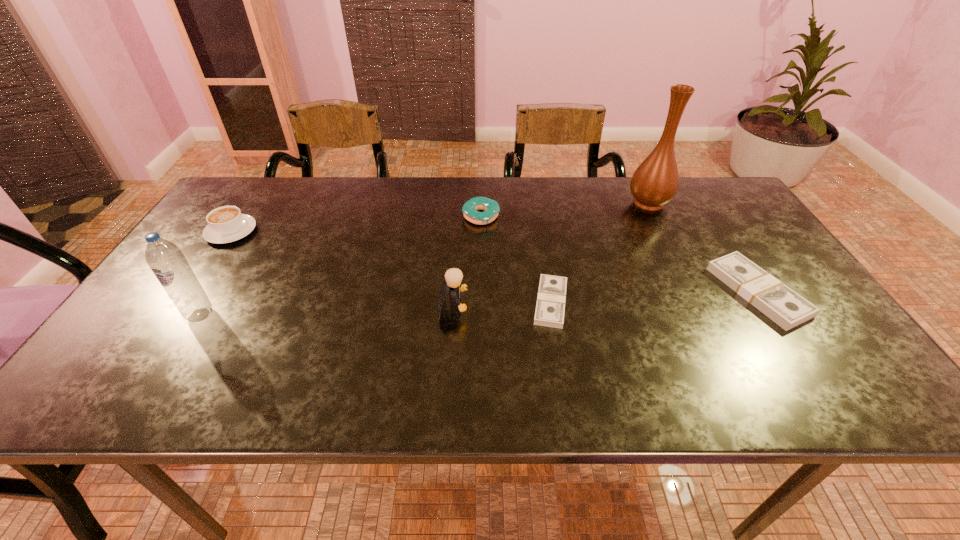
Find the location of a particular element. The width and height of the screenshot is (960, 540). vase located in the far edge section of the desktop is located at coordinates (655, 182).

The height and width of the screenshot is (540, 960). I want to click on cappuccino that is at the left edge, so click(226, 224).

This screenshot has width=960, height=540. I want to click on water bottle present at the left edge, so click(167, 262).

You are a GUI agent. You are given a task and a screenshot of the screen. Output one action in this format:
    pyautogui.click(x=<x>, y=<y>)
    Task: Click on the object that is positioned at the right edge
    This screenshot has height=540, width=960.
    Given the screenshot: What is the action you would take?
    pyautogui.click(x=781, y=304)

Where is `object at the far left corner`? object at the far left corner is located at coordinates (226, 224).

I want to click on vacant space at the far edge, so click(509, 192).

Where is `blank area at the near edge`? The height and width of the screenshot is (540, 960). blank area at the near edge is located at coordinates (568, 359).

In the image, there is a desktop. Where is `free space at the left edge`? This screenshot has height=540, width=960. free space at the left edge is located at coordinates (155, 289).

Find the location of `vacant space at the right edge`. vacant space at the right edge is located at coordinates (776, 266).

At what (x,y) coordinates should I click in order to perform the action: click on vacant point at the far left corner. Please return your answer as a coordinate pair (x, y). Looking at the image, I should click on (249, 201).